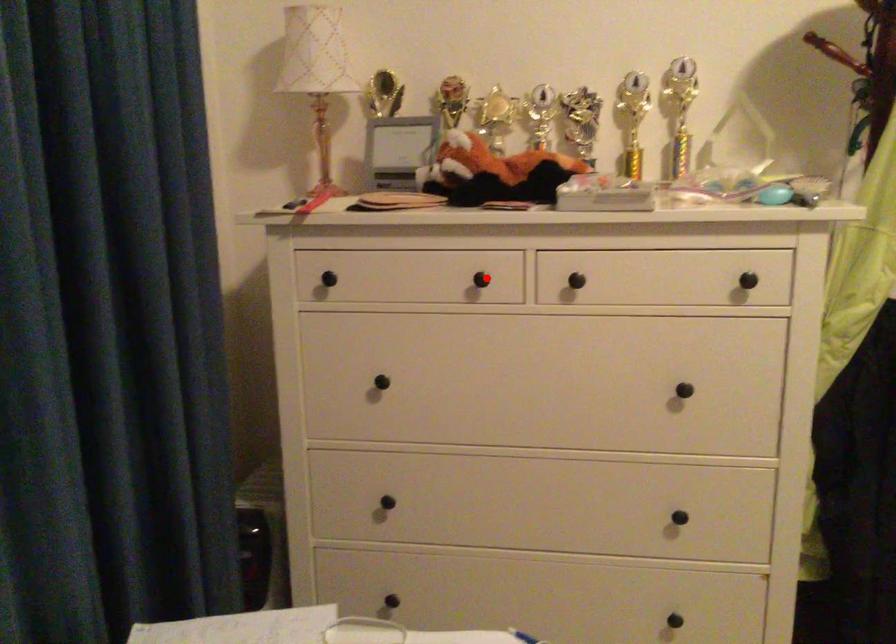
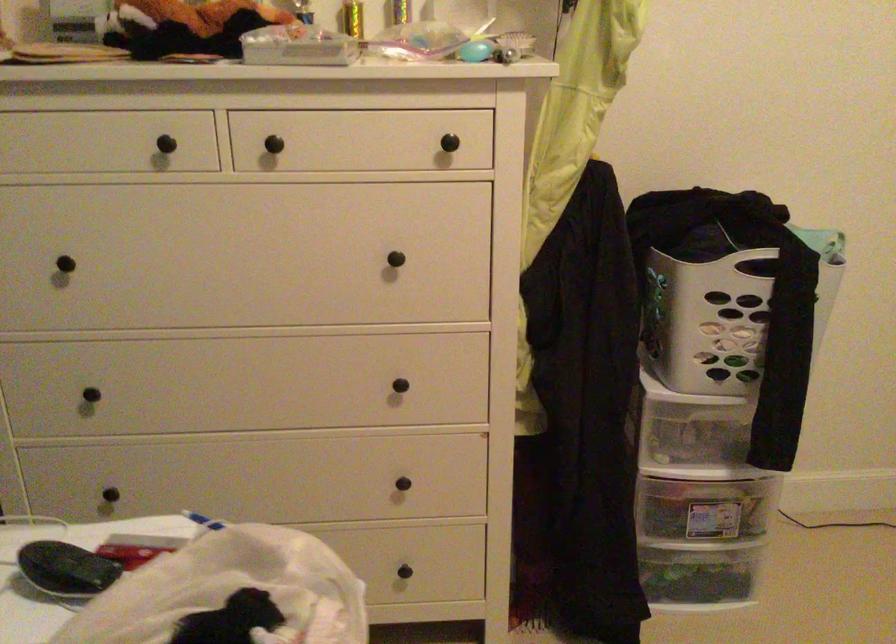
Where in the second image is the point corresponding to the highlighted location from the first image?

(173, 142)